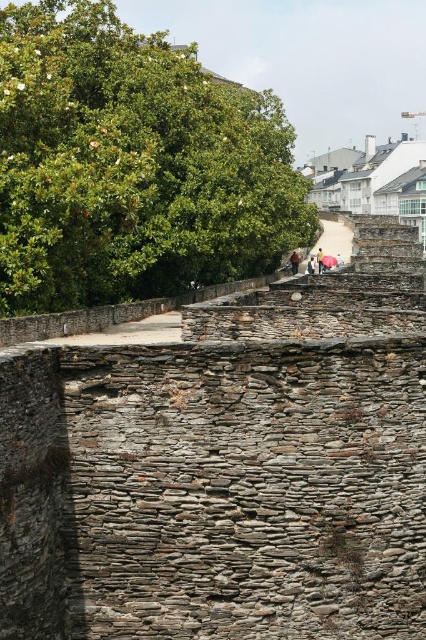
Question: Which point is farther to the camera?

Choices:
 (A) light brown leather jacket at upper center
 (B) brown leather jacket at center
 (C) light brown fabric umbrella at upper center
 (D) matte pink umbrella at upper center

Answer: (B)

Question: Which point is farther from the camera taking this photo?

Choices:
 (A) (342, 259)
 (B) (307, 268)
 (C) (293, 273)

Answer: (A)

Question: Does light brown leather jacket at upper center appear under light brown fabric umbrella at upper center?

Choices:
 (A) yes
 (B) no

Answer: (A)

Question: Which of the following is the farthest from the observer?

Choices:
 (A) brown leather jacket at center
 (B) light brown fabric umbrella at upper center
 (C) light brown leather jacket at upper center

Answer: (A)

Question: Does matte pink umbrella at upper center come in front of light brown fabric umbrella at upper center?

Choices:
 (A) no
 (B) yes

Answer: (B)

Question: Where is matte pink umbrella at upper center located in relation to light brown fabric umbrella at upper center in the image?

Choices:
 (A) above
 (B) below

Answer: (B)